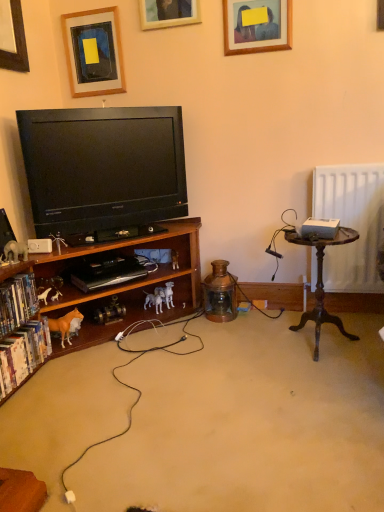
I want to click on vacant area in front of copper glass lantern at center, the second toy when ordered from back to front, so click(224, 331).